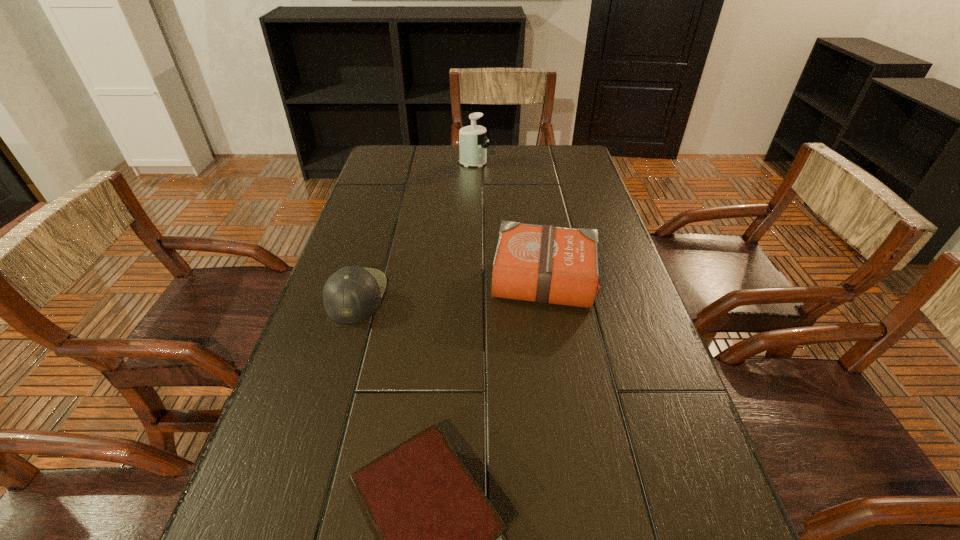
Locate an element on the screen. object present at the right edge is located at coordinates (545, 264).

This screenshot has width=960, height=540. In the image, there is a desktop. Find the location of `vacant space at the far edge`. vacant space at the far edge is located at coordinates (455, 171).

You are a GUI agent. You are given a task and a screenshot of the screen. Output one action in this format:
    pyautogui.click(x=<x>, y=<y>)
    Task: Click on the free space at the left edge
    
    Given the screenshot: What is the action you would take?
    pyautogui.click(x=381, y=181)

You are a GUI agent. You are given a task and a screenshot of the screen. Output one action in this format:
    pyautogui.click(x=<x>, y=<y>)
    Task: Click on the vacant space at the right edge of the desktop
    This screenshot has height=540, width=960.
    Given the screenshot: What is the action you would take?
    pyautogui.click(x=698, y=453)

Find the location of a particular element. The width and height of the screenshot is (960, 540). vacant area that lies between the juicer and the cap is located at coordinates (415, 229).

Locate which object ranks third in proximity to the farther Bible. Please provide its 2D coordinates. Your answer should be formatted as a tuple, i.e. [(x, y)], where the tuple contains the x and y coordinates of a point satisfying the conditions above.

[(472, 139)]

Locate which object is the closest to the taller Bible. Please provide its 2D coordinates. Your answer should be formatted as a tuple, i.e. [(x, y)], where the tuple contains the x and y coordinates of a point satisfying the conditions above.

[(352, 294)]

At what (x,y) coordinates should I click in order to perform the action: click on vacant space that satisfies the following two spatial constraints: 1. on the front side of the farther Bible; 2. on the brim of the leftmost object. Please return your answer as a coordinate pair (x, y). The height and width of the screenshot is (540, 960). Looking at the image, I should click on (546, 295).

Find the location of `vacant area that satisfies the following two spatial constraints: 1. on the front side of the farthest object; 2. on the brim of the second shortest object`. vacant area that satisfies the following two spatial constraints: 1. on the front side of the farthest object; 2. on the brim of the second shortest object is located at coordinates pyautogui.click(x=469, y=295).